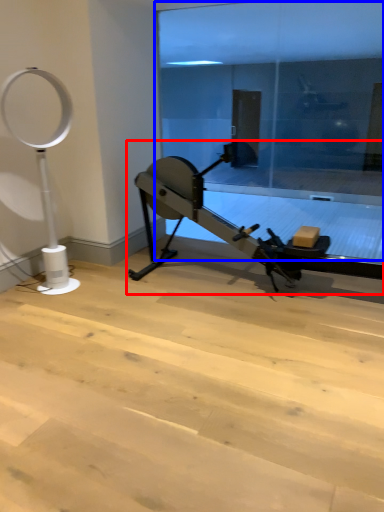
Question: Among these objects, which one is farthest to the camera, stationary bicycle (highlighted by a red box) or glass door (highlighted by a blue box)?

Choices:
 (A) stationary bicycle
 (B) glass door

Answer: (B)